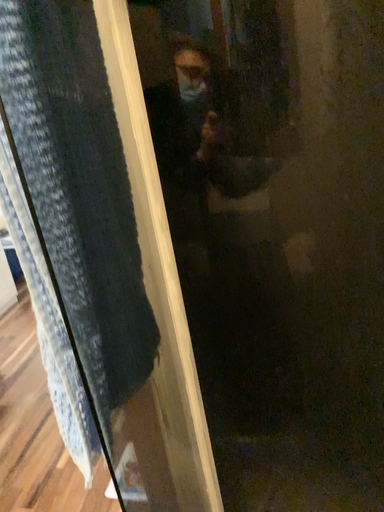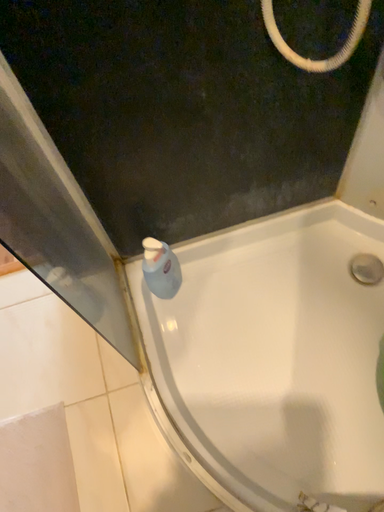
Question: How did the camera likely rotate when shooting the video?

Choices:
 (A) rotated left
 (B) rotated right

Answer: (B)